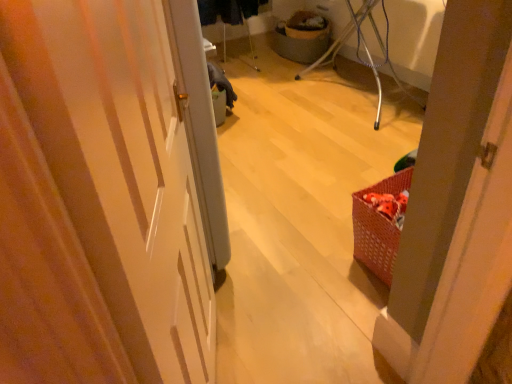
Question: Considering the positions of matte gray basket at center and white glossy door at center in the image, is matte gray basket at center bigger or smaller than white glossy door at center?

Choices:
 (A) big
 (B) small

Answer: (B)

Question: From a real-world perspective, is matte gray basket at center physically located above or below white glossy door at center?

Choices:
 (A) below
 (B) above

Answer: (A)

Question: In terms of width, does matte gray basket at center look wider or thinner when compared to white glossy door at center?

Choices:
 (A) wide
 (B) thin

Answer: (A)

Question: From a real-world perspective, is white glossy door at center positioned above or below matte gray basket at center?

Choices:
 (A) below
 (B) above

Answer: (B)

Question: Is point (120, 297) closer or farther from the camera than point (290, 44)?

Choices:
 (A) closer
 (B) farther

Answer: (A)

Question: Is white glossy door at center inside or outside of matte gray basket at center?

Choices:
 (A) outside
 (B) inside

Answer: (A)

Question: Considering their positions, is white glossy door at center located in front of or behind matte gray basket at center?

Choices:
 (A) behind
 (B) front

Answer: (B)